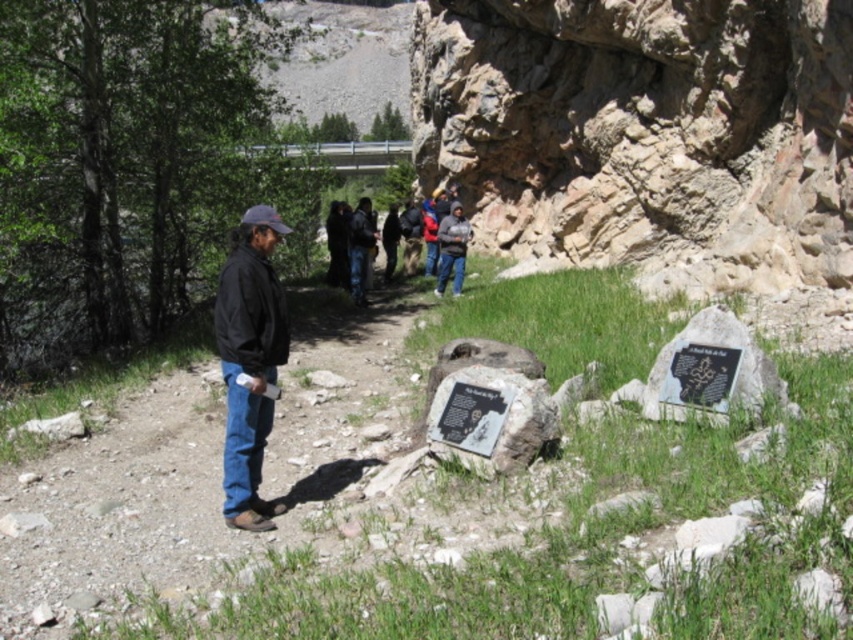
Question: Does dark clothing group at center have a smaller size compared to dark gray sweater at center?

Choices:
 (A) no
 (B) yes

Answer: (A)

Question: Estimate the real-world distances between objects in this image. Which object is farther from the dark blue jacket at center?

Choices:
 (A) black stone plaque at lower right
 (B) rocky dirt path at center

Answer: (A)

Question: Does black leather jacket at center appear on the left side of dark gray sweater at center?

Choices:
 (A) yes
 (B) no

Answer: (A)

Question: Does dark clothing group at center have a larger size compared to gray stone plaque at center?

Choices:
 (A) no
 (B) yes

Answer: (B)

Question: Which point is closer to the camera?

Choices:
 (A) (343, 200)
 (B) (492, 410)
 (C) (462, 230)
 (D) (345, 396)

Answer: (B)

Question: Which point is farther from the camera taking this photo?

Choices:
 (A) (440, 253)
 (B) (367, 230)
 (C) (848, 416)

Answer: (A)